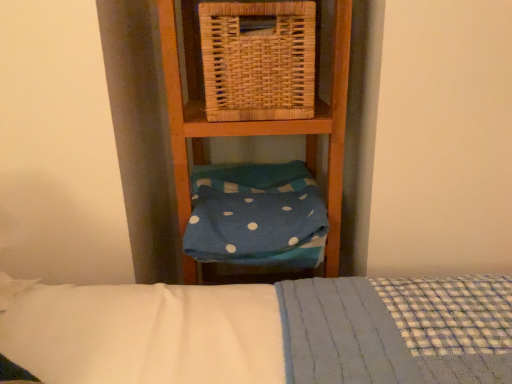
Question: Is woven natural picnic basket at upper center smaller than blue polka dot fabric at center?

Choices:
 (A) no
 (B) yes

Answer: (B)

Question: Can you confirm if woven natural picnic basket at upper center is shorter than blue polka dot fabric at center?

Choices:
 (A) no
 (B) yes

Answer: (A)

Question: Can you confirm if woven natural picnic basket at upper center is positioned to the right of blue polka dot fabric at center?

Choices:
 (A) yes
 (B) no

Answer: (A)

Question: Is woven natural picnic basket at upper center outside blue polka dot fabric at center?

Choices:
 (A) no
 (B) yes

Answer: (B)

Question: From a real-world perspective, is woven natural picnic basket at upper center on top of blue polka dot fabric at center?

Choices:
 (A) no
 (B) yes

Answer: (B)

Question: Considering the relative sizes of woven natural picnic basket at upper center and blue polka dot fabric at center in the image provided, is woven natural picnic basket at upper center wider than blue polka dot fabric at center?

Choices:
 (A) yes
 (B) no

Answer: (B)

Question: Considering the relative positions of blue polka dot fabric at center and woven natural picnic basket at upper center in the image provided, is blue polka dot fabric at center to the right of woven natural picnic basket at upper center from the viewer's perspective?

Choices:
 (A) no
 (B) yes

Answer: (A)

Question: Does blue polka dot fabric at center have a lesser width compared to woven natural picnic basket at upper center?

Choices:
 (A) no
 (B) yes

Answer: (A)

Question: Is blue polka dot fabric at center not near woven natural picnic basket at upper center?

Choices:
 (A) yes
 (B) no

Answer: (B)

Question: Is blue polka dot fabric at center further to the viewer compared to woven natural picnic basket at upper center?

Choices:
 (A) yes
 (B) no

Answer: (A)

Question: From a real-world perspective, is blue polka dot fabric at center on woven natural picnic basket at upper center?

Choices:
 (A) yes
 (B) no

Answer: (B)

Question: Is blue polka dot fabric at center to the left of woven natural picnic basket at upper center from the viewer's perspective?

Choices:
 (A) yes
 (B) no

Answer: (A)

Question: Choose the correct answer: Is woven natural picnic basket at upper center inside blue polka dot fabric at center or outside it?

Choices:
 (A) inside
 (B) outside

Answer: (B)